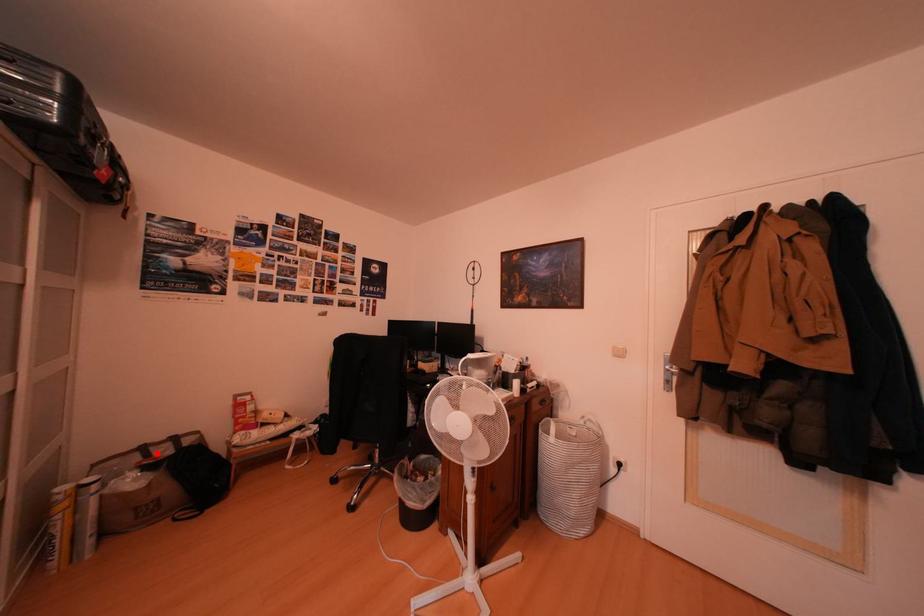
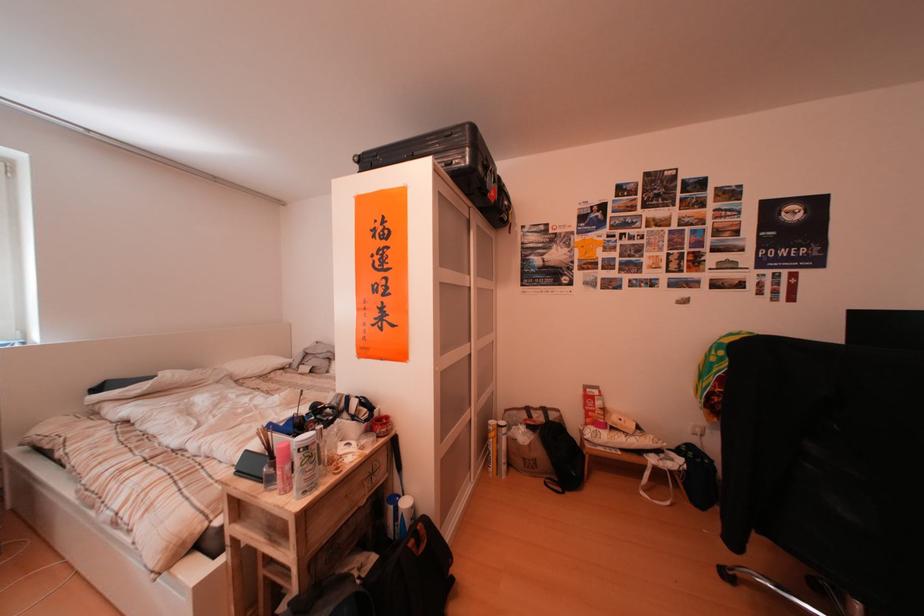
Question: I am providing you with two images of the same scene from different viewpoints. Image1 has a red point marked. In image2, the corresponding 3D location appears at what relative position? Reply with the corresponding letter.

Choices:
 (A) Closer
 (B) Farther

Answer: (B)